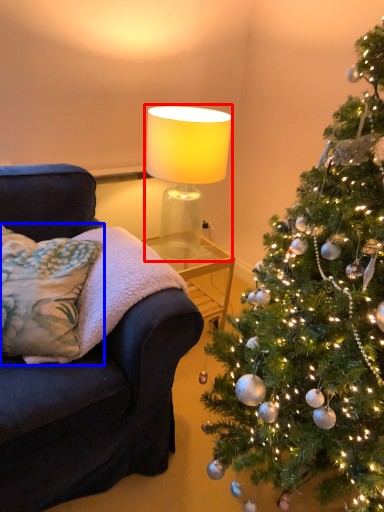
Question: Among these objects, which one is nearest to the camera, lamp (highlighted by a red box) or pillow (highlighted by a blue box)?

Choices:
 (A) lamp
 (B) pillow

Answer: (B)